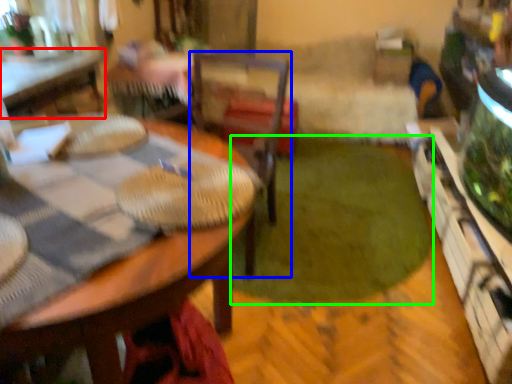
Question: Estimate the real-world distances between objects in this image. Which object is farther from table (highlighted by a red box), chair (highlighted by a blue box) or grass (highlighted by a green box)?

Choices:
 (A) chair
 (B) grass

Answer: (B)